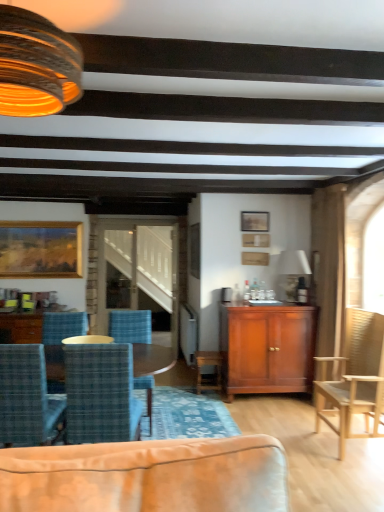
Question: Is blue plaid fabric chair at center, which ranks as the 2th chair in right-to-left order, wider or thinner than wooden picture frame at upper center, arranged as the second picture frame when viewed from the right?

Choices:
 (A) thin
 (B) wide

Answer: (B)

Question: Is point (119, 364) positioned closer to the camera than point (258, 211)?

Choices:
 (A) closer
 (B) farther

Answer: (A)

Question: Which object is positioned closest to the wooden picture frame at upper center, which ranks as the 3th picture frame in left-to-right order?

Choices:
 (A) wooden glossy coffee table at lower left
 (B) wooden chair at right
 (C) matte wood cabinet at center
 (D) matte glass lampshade at upper left, arranged as the 2th lamp when viewed from the right
 (E) blue plaid fabric chair at center, which ranks as the 2th chair in right-to-left order

Answer: (B)

Question: Based on their relative distances, which object is nearer to the matte glass lampshade at upper left, arranged as the first lamp when viewed from the front?

Choices:
 (A) matte wood cabinet at center
 (B) wooden picture frame at upper center, the second picture frame positioned from the left
 (C) wooden picture frame at upper center, which ranks as the 3th picture frame in left-to-right order
 (D) blue plaid chair at center, the second chair when ordered from left to right
 (E) blue plaid fabric chair at center, which ranks as the 2th chair in right-to-left order

Answer: (E)